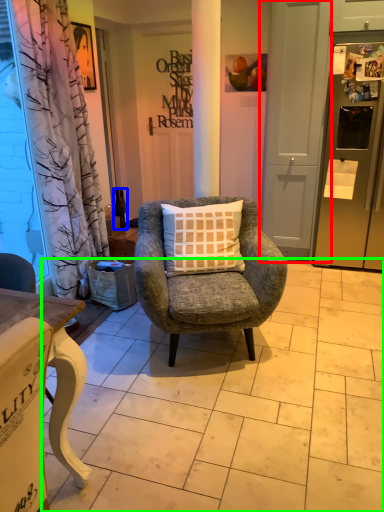
Question: Estimate the real-world distances between objects in this image. Which object is farther from screen door (highlighted by a red box), bottle (highlighted by a blue box) or tile (highlighted by a green box)?

Choices:
 (A) bottle
 (B) tile

Answer: (B)